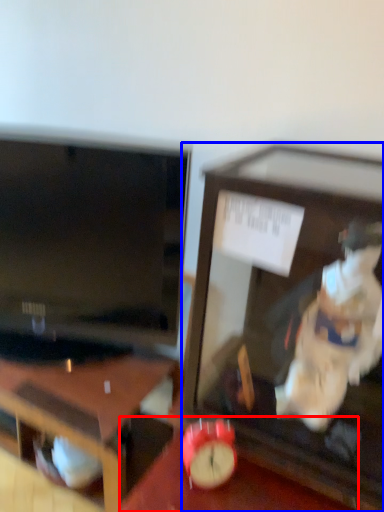
Question: Which object is further to the camera taking this photo, table (highlighted by a red box) or furniture (highlighted by a blue box)?

Choices:
 (A) table
 (B) furniture

Answer: (A)